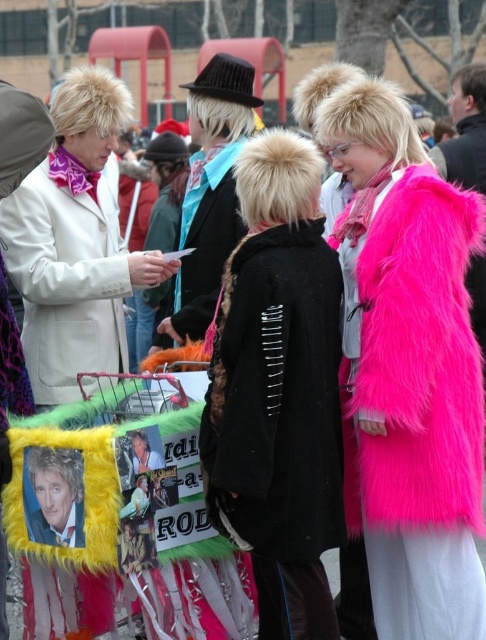
You are organizing a costume party and need to arrange seating so that the fuzzy pink coat at upper right and the black fur coat at center can both fit comfortably. Given their sizes, which coat requires more space?

The fuzzy pink coat at upper right requires more space because it is bigger than the black fur coat at center.

You are a photographer at the event and need to capture a photo that includes both the fuzzy pink coat at upper right and the black fur coat at center. Given that your camera has a maximum focus range of 5 meters, will you be able to fit both subjects into the frame?

The distance between the fuzzy pink coat at upper right and the black fur coat at center is 6.03 meters, which exceeds the camera maximum focus range of 5 meters. Therefore, you cannot fit both subjects into the frame.